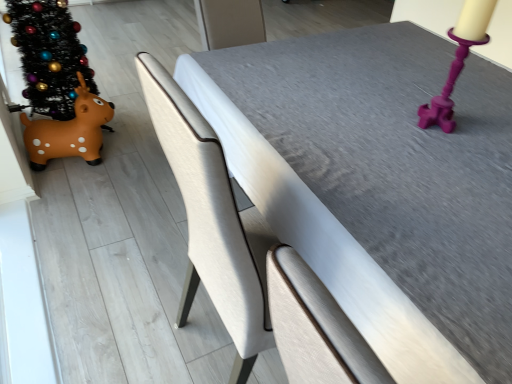
I want to click on free region on the left part of purple plastic candle holder at upper right, so click(x=378, y=124).